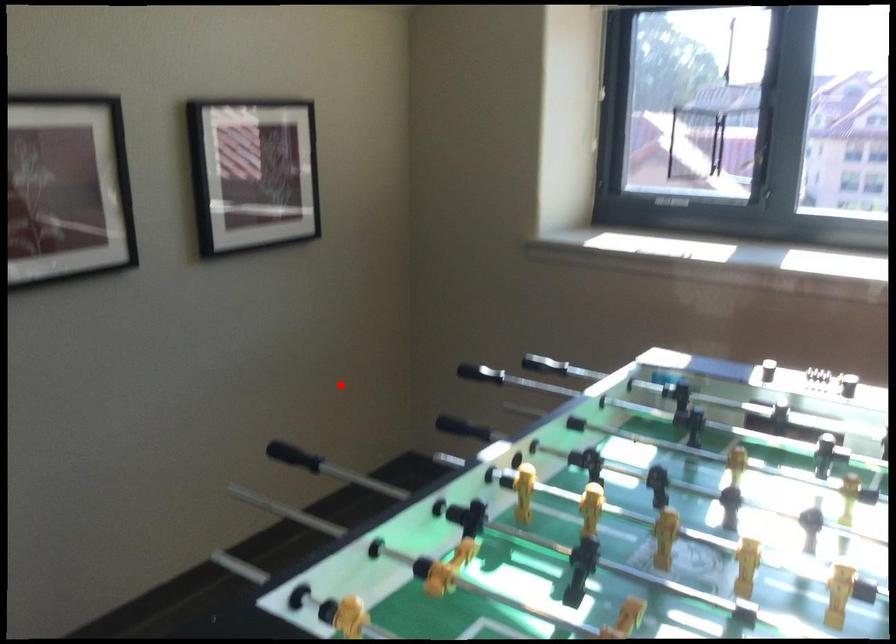
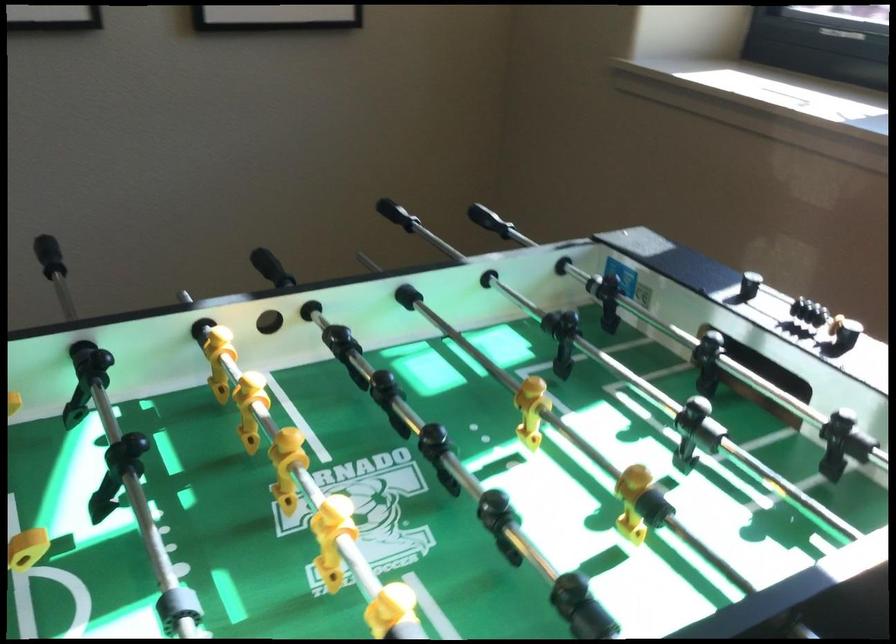
In the second image, find the point that corresponds to the highlighted location in the first image.

(397, 214)